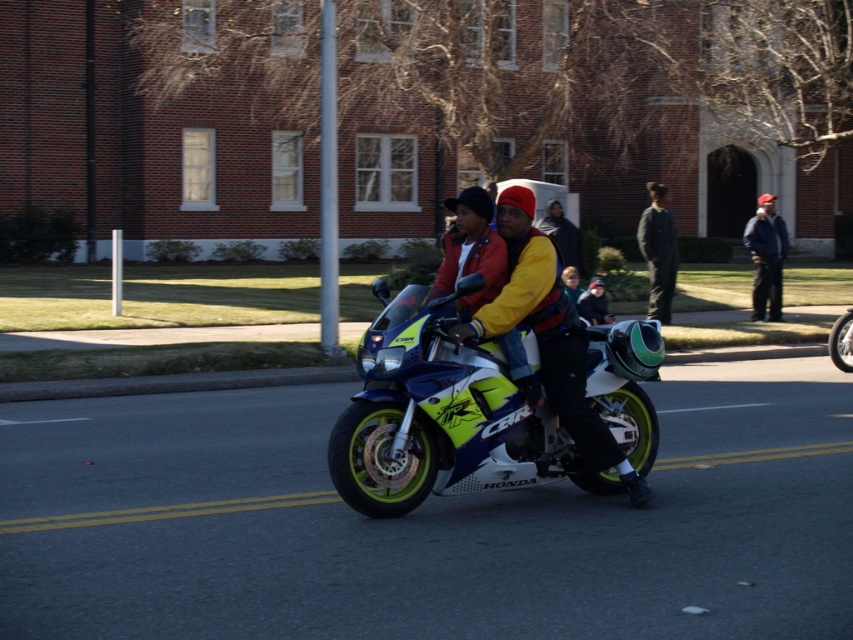
Between neon yellow/green plastic motorbike at center and yellow matte jacket at center, which one has less height?

With less height is neon yellow/green plastic motorbike at center.

Where is `neon yellow/green plastic motorbike at center`? This screenshot has height=640, width=853. neon yellow/green plastic motorbike at center is located at coordinates (440, 417).

Locate an element on the screen. Image resolution: width=853 pixels, height=640 pixels. yellow matte jacket at center is located at coordinates (549, 337).

Does point (541, 284) come farther from viewer compared to point (643, 230)?

No, it is not.

In order to click on yellow matte jacket at center in this screenshot , I will do `click(549, 337)`.

In the scene shown: Is neon yellow/green plastic motorbike at center in front of dark gray jumpsuit at center?

Yes, neon yellow/green plastic motorbike at center is in front of dark gray jumpsuit at center.

Who is shorter, neon yellow/green plastic motorbike at center or dark gray jumpsuit at center?

dark gray jumpsuit at center

Image resolution: width=853 pixels, height=640 pixels. Identify the location of neon yellow/green plastic motorbike at center. (440, 417).